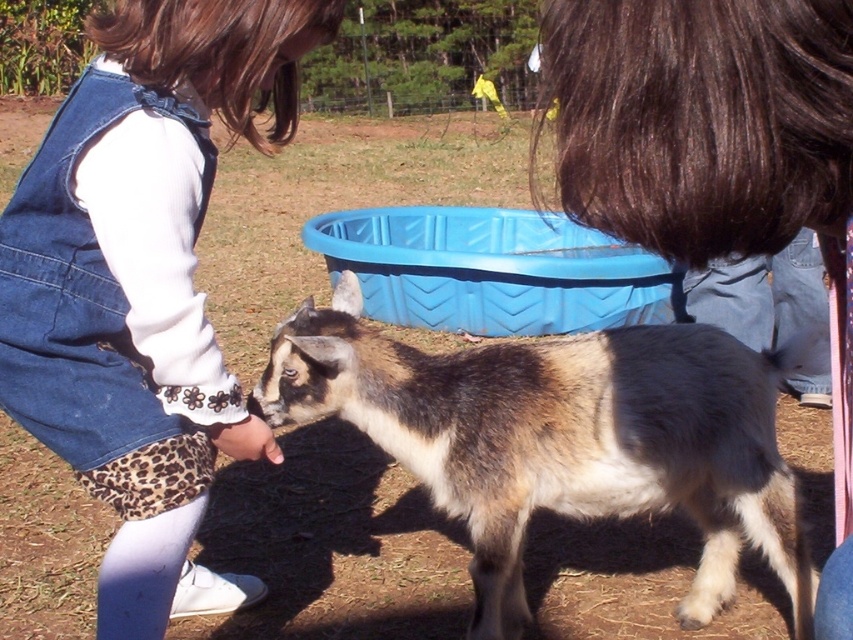
Which of these two, brown and white fur goat at center or dark brown hair at upper center, stands taller?

With more height is brown and white fur goat at center.

Which is below, brown and white fur goat at center or dark brown hair at upper center?

Positioned lower is brown and white fur goat at center.

Is point (705, 483) farther from viewer compared to point (651, 88)?

Yes, point (705, 483) is farther from viewer.

Where is `brown and white fur goat at center`? brown and white fur goat at center is located at coordinates (563, 440).

Is point (138, 157) farther from viewer compared to point (842, 145)?

That is True.

Is point (202, 22) closer to camera compared to point (799, 68)?

No, (202, 22) is further to viewer.

The image size is (853, 640). In order to click on denim overalls at center in this screenshot , I will do `click(143, 284)`.

Does denim overalls at center have a greater height compared to brown and white fur goat at center?

Indeed, denim overalls at center has a greater height compared to brown and white fur goat at center.

Does denim overalls at center appear on the right side of brown and white fur goat at center?

No, denim overalls at center is not to the right of brown and white fur goat at center.

The height and width of the screenshot is (640, 853). What do you see at coordinates (143, 284) in the screenshot?
I see `denim overalls at center` at bounding box center [143, 284].

Where is `denim overalls at center`? denim overalls at center is located at coordinates (143, 284).